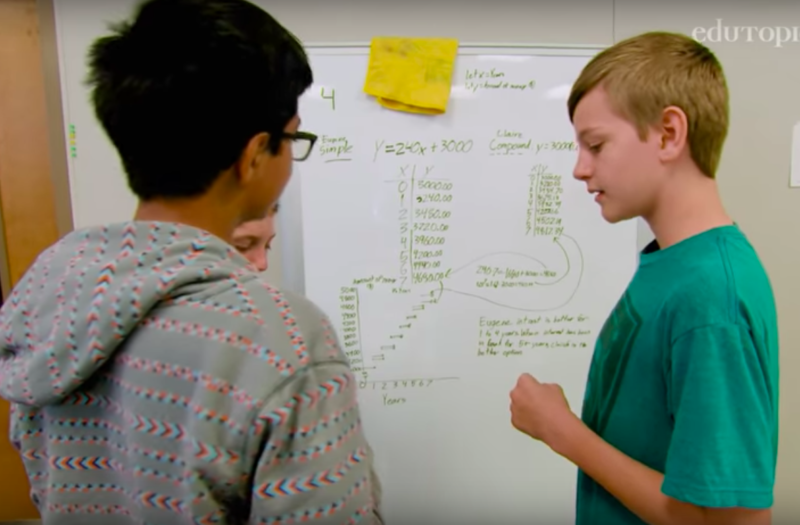
Locate an element on the screen. This screenshot has height=525, width=800. wall is located at coordinates (764, 100), (541, 16).